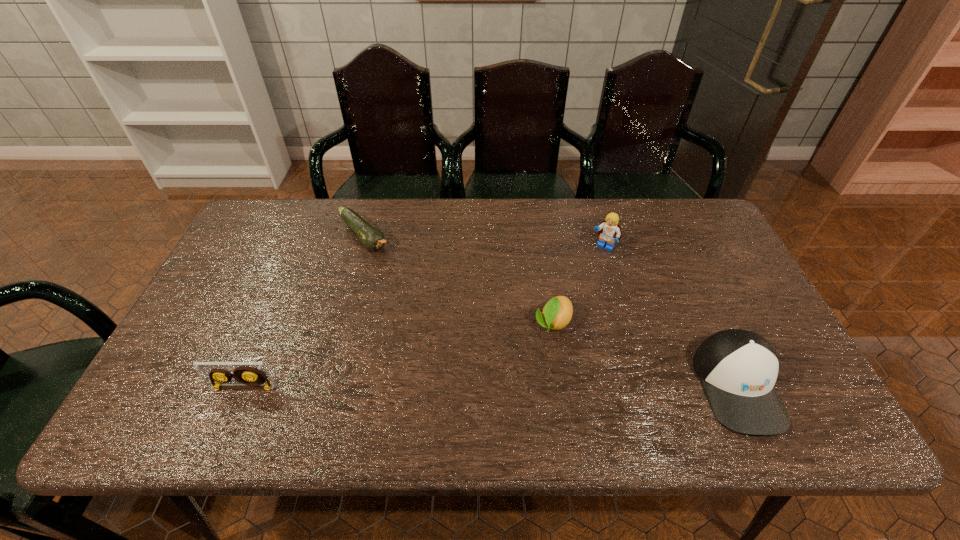
This screenshot has height=540, width=960. In order to click on object present at the left edge in this screenshot , I will do `click(248, 375)`.

Image resolution: width=960 pixels, height=540 pixels. Find the location of `object located at the right edge`. object located at the right edge is located at coordinates (738, 369).

Where is `object that is at the near left corner`? object that is at the near left corner is located at coordinates (248, 375).

I want to click on object that is positioned at the near right corner, so click(x=738, y=369).

Find the location of a particular element. The height and width of the screenshot is (540, 960). free space at the far edge of the desktop is located at coordinates (633, 222).

At what (x,y) coordinates should I click in order to perform the action: click on free space at the near edge. Please return your answer as a coordinate pair (x, y). Looking at the image, I should click on (450, 390).

I want to click on vacant space at the right edge of the desktop, so click(738, 302).

Image resolution: width=960 pixels, height=540 pixels. What are the coordinates of `vacant space at the near left corner of the desktop` in the screenshot? It's located at (188, 384).

Locate an element on the screen. free space at the far right corner of the desktop is located at coordinates (653, 200).

The height and width of the screenshot is (540, 960). Identify the location of free spot between the cap and the lemon. (645, 355).